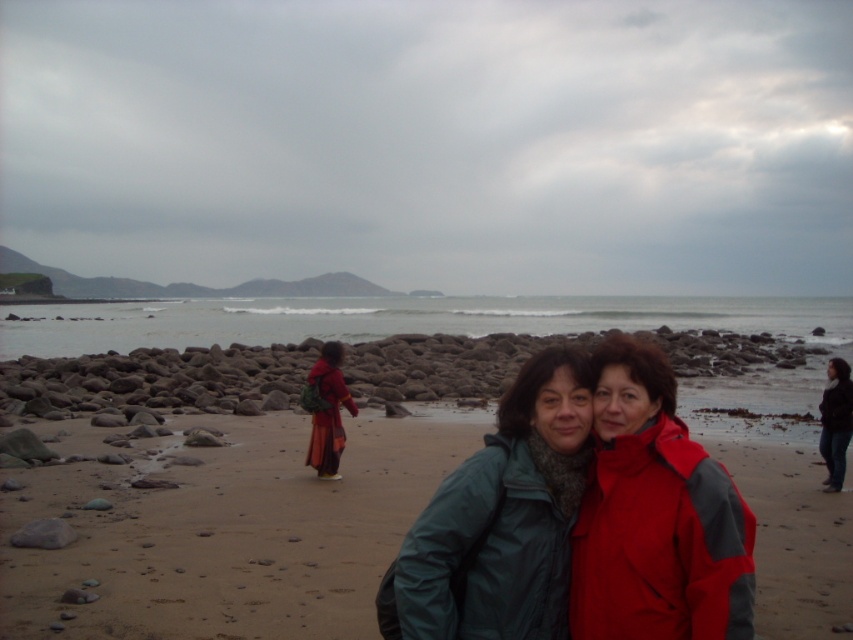
You are a photographer trying to capture a photo of the smooth sand beach at center and the matte orange dress at center. Based on their positions, which object should you adjust your camera to focus on first if you want to include both in the frame?

The smooth sand beach at center is to the right of matte orange dress at center, so you should focus on the matte orange dress at center first to ensure both are in the frame.

You are a photographer trying to capture a shot of the clear water at center and the matte orange dress at center. Which object should you adjust your camera to focus on first if you want to ensure both are in the frame without moving the camera?

The matte orange dress at center should be focused on first because the clear water at center is positioned to its right, so adjusting focus starting from the left would naturally include both in the frame.

You are a photographer trying to capture the reflection of the matte orange dress at center in the clear water at center. Based on the scene, can you confirm if the dress is positioned in a way that its reflection would be visible in the water?

The clear water at center is above matte orange dress at center, so the dress is below the water. Since the water is clear and calm, the reflection of the matte orange dress at center should be visible on the surface of the clear water at center.